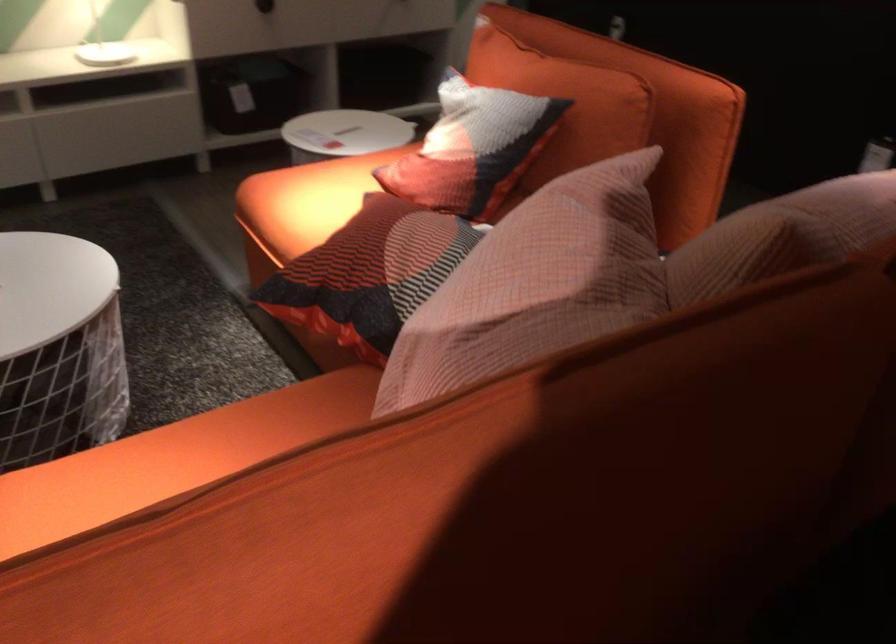
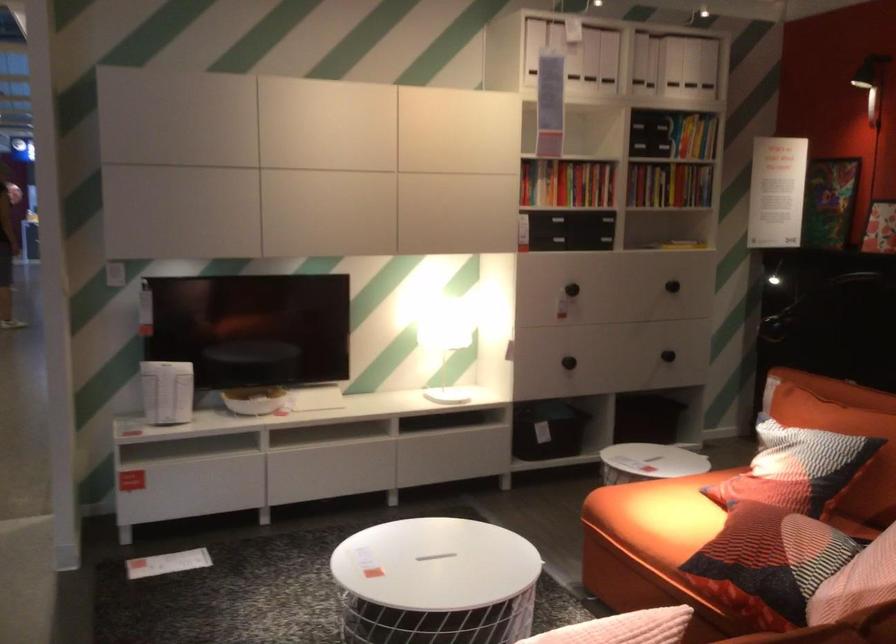
First-person continuous shooting, in which direction is the camera rotating?

The rotation direction of the camera is left-up.